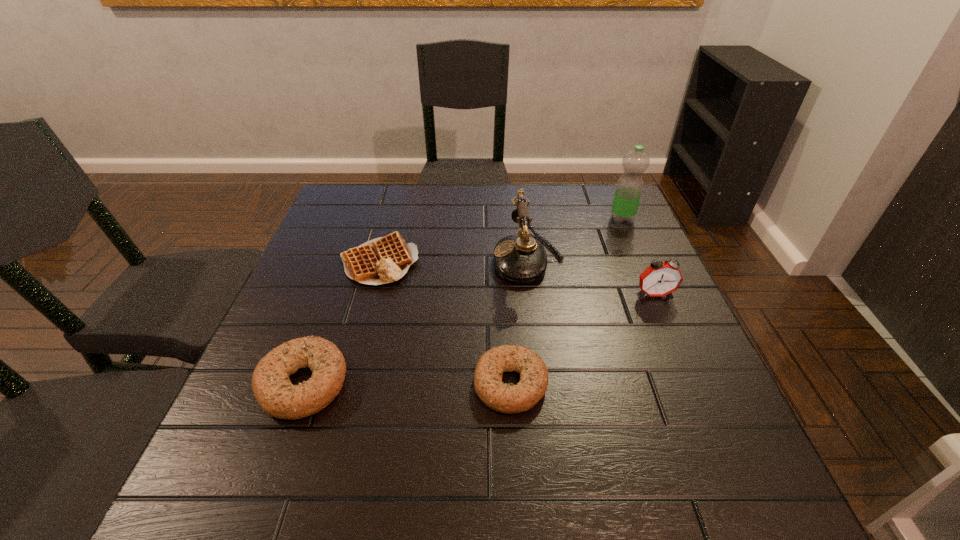
Locate an element on the screen. alarm clock present at the right edge is located at coordinates (660, 279).

Where is `object that is positioned at the near left corner`? object that is positioned at the near left corner is located at coordinates (276, 395).

The height and width of the screenshot is (540, 960). I want to click on object that is at the far right corner, so click(629, 187).

At what (x,y) coordinates should I click in order to perform the action: click on free region at the far edge of the desktop. Please return your answer as a coordinate pair (x, y). This screenshot has width=960, height=540. Looking at the image, I should click on (x=555, y=225).

Locate an element on the screen. This screenshot has width=960, height=540. vacant space at the left edge of the desktop is located at coordinates (341, 279).

The height and width of the screenshot is (540, 960). I want to click on vacant space at the far left corner of the desktop, so click(x=366, y=208).

In the image, there is a desktop. At what (x,y) coordinates should I click in order to perform the action: click on vacant space at the far right corner. Please return your answer as a coordinate pair (x, y). This screenshot has width=960, height=540. Looking at the image, I should click on (594, 206).

This screenshot has height=540, width=960. What are the coordinates of `unoccupied position between the telephone and the farthest object` in the screenshot? It's located at (575, 239).

Locate an element on the screen. Image resolution: width=960 pixels, height=540 pixels. unoccupied position between the third shortest object and the right bagel is located at coordinates (407, 383).

Where is `free area in between the waffle and the third shortest object`? free area in between the waffle and the third shortest object is located at coordinates (341, 323).